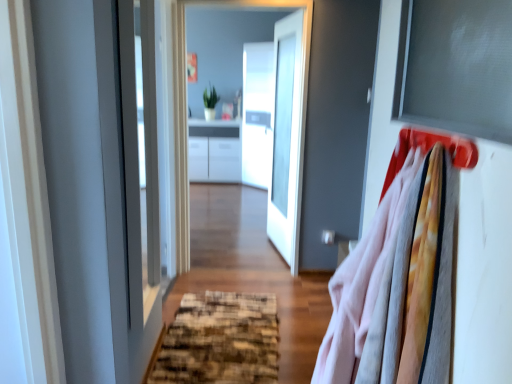
Question: Does matte gray window screen at upper right have a greater height compared to matte plastic hanger at upper right?

Choices:
 (A) yes
 (B) no

Answer: (A)

Question: Is matte gray window screen at upper right bigger than matte plastic hanger at upper right?

Choices:
 (A) yes
 (B) no

Answer: (A)

Question: Can we say matte gray window screen at upper right lies outside matte plastic hanger at upper right?

Choices:
 (A) no
 (B) yes

Answer: (B)

Question: Is matte plastic hanger at upper right a part of matte gray window screen at upper right?

Choices:
 (A) yes
 (B) no

Answer: (B)

Question: Is matte gray window screen at upper right at the right side of matte plastic hanger at upper right?

Choices:
 (A) no
 (B) yes

Answer: (B)

Question: Is transparent glass door at center taller or shorter than matte plastic hanger at upper right?

Choices:
 (A) short
 (B) tall

Answer: (B)

Question: Is transparent glass door at center to the left or to the right of matte plastic hanger at upper right in the image?

Choices:
 (A) left
 (B) right

Answer: (A)

Question: Considering the positions of point (146, 104) and point (476, 145), is point (146, 104) closer or farther from the camera than point (476, 145)?

Choices:
 (A) closer
 (B) farther

Answer: (B)

Question: Looking at their shapes, would you say transparent glass door at center is wider or thinner than matte plastic hanger at upper right?

Choices:
 (A) wide
 (B) thin

Answer: (B)

Question: Considering the relative positions of matte gray window screen at upper right and transparent glass door at center in the image provided, is matte gray window screen at upper right to the left or to the right of transparent glass door at center?

Choices:
 (A) left
 (B) right

Answer: (B)

Question: From the image's perspective, relative to transparent glass door at center, is matte gray window screen at upper right above or below?

Choices:
 (A) below
 (B) above

Answer: (A)

Question: Do you think matte gray window screen at upper right is within transparent glass door at center, or outside of it?

Choices:
 (A) inside
 (B) outside

Answer: (B)

Question: From a real-world perspective, is matte gray window screen at upper right above or below transparent glass door at center?

Choices:
 (A) below
 (B) above

Answer: (B)

Question: From a real-world perspective, is matte gray window screen at upper right above or below textured brown doormat at center?

Choices:
 (A) below
 (B) above

Answer: (B)

Question: Would you say matte gray window screen at upper right is inside or outside textured brown doormat at center?

Choices:
 (A) outside
 (B) inside

Answer: (A)